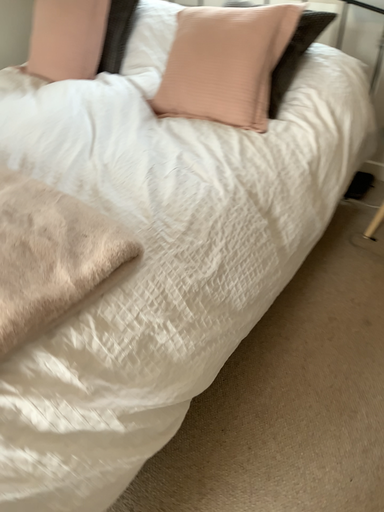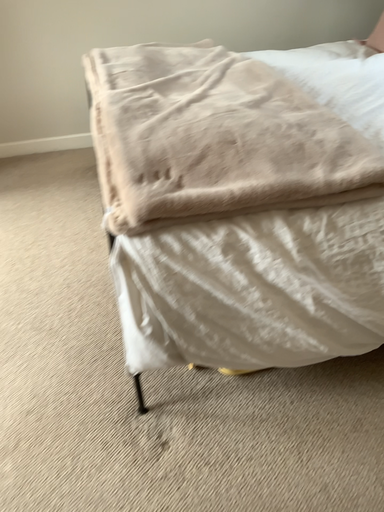
Question: Which way did the camera rotate in the video?

Choices:
 (A) rotated downward
 (B) rotated upward

Answer: (B)